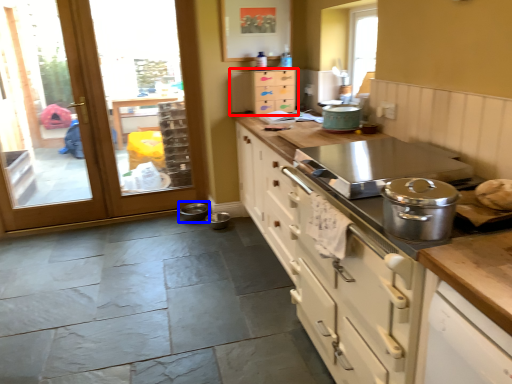
Question: Which object appears closest to the camera in this image, cabinetry (highlighted by a red box) or appliance (highlighted by a blue box)?

Choices:
 (A) cabinetry
 (B) appliance

Answer: (A)